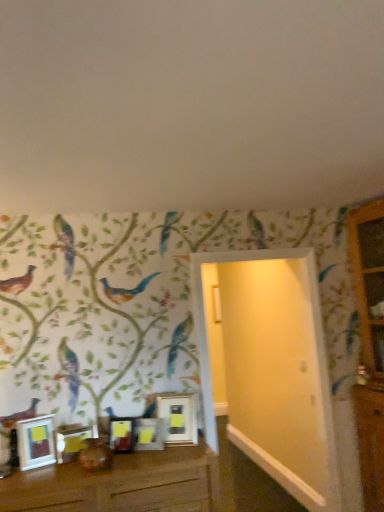
Question: Based on their positions, is metallic silver frame at center, which ranks as the 4th picture frame in left-to-right order, located to the left or right of brown wooden table at lower center?

Choices:
 (A) right
 (B) left

Answer: (A)

Question: From their relative heights in the image, would you say metallic silver frame at center, which ranks as the 2th picture frame in right-to-left order, is taller or shorter than brown wooden table at lower center?

Choices:
 (A) tall
 (B) short

Answer: (B)

Question: Considering the real-world distances, which object is farthest from the metallic silver frame at center, which ranks as the 2th picture frame in right-to-left order?

Choices:
 (A) white glossy picture frame at lower left, acting as the 5th picture frame starting from the right
 (B) matte silver picture frame at center, arranged as the 3th picture frame when viewed from the left
 (C) metallic silver picture frame at center, the 1th picture frame viewed from the right
 (D) brown wooden table at lower center
 (E) wooden dresser at right

Answer: (E)

Question: Based on their relative distances, which object is farther from the brown wooden table at lower center?

Choices:
 (A) matte silver picture frame at lower left, which ranks as the second picture frame in left-to-right order
 (B) matte silver picture frame at center, which is the 3th picture frame in right-to-left order
 (C) metallic silver picture frame at center, the 1th picture frame viewed from the right
 (D) white glossy picture frame at lower left, the 1th picture frame positioned from the left
 (E) metallic silver frame at center, which ranks as the 2th picture frame in right-to-left order

Answer: (C)